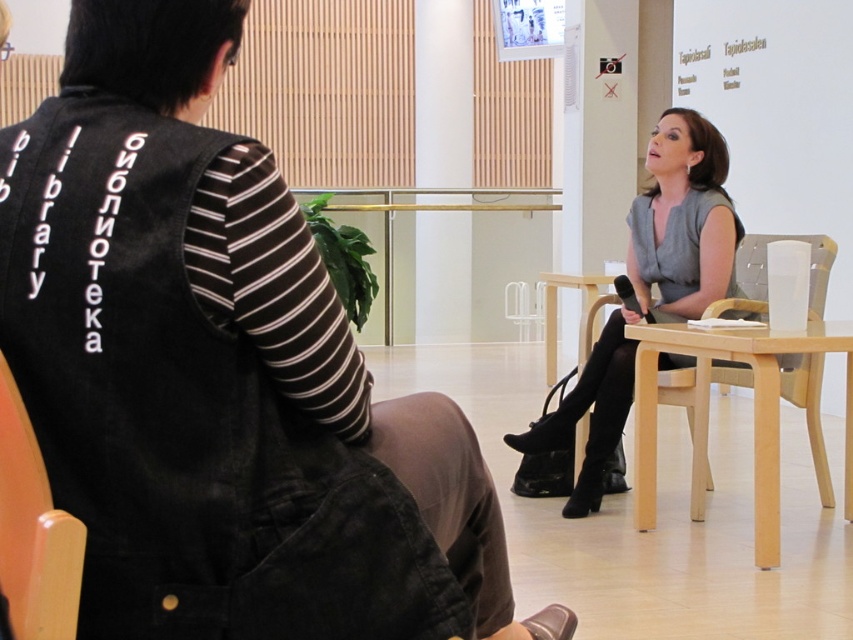
Is denim vest at center further to the viewer compared to light wood armchair at right?

That is False.

Is denim vest at center in front of light wood armchair at right?

Yes, it is.

Is point (219, 16) positioned after point (820, 502)?

That is False.

Locate an element on the screen. Image resolution: width=853 pixels, height=640 pixels. denim vest at center is located at coordinates (288, 282).

Looking at this image, does matte gray dress at center have a smaller size compared to wooden chair at lower left?

Incorrect, matte gray dress at center is not smaller in size than wooden chair at lower left.

Locate an element on the screen. matte gray dress at center is located at coordinates (648, 289).

Measure the distance between wooden chair at lower left and light wood armchair at right.

wooden chair at lower left and light wood armchair at right are 12.68 feet apart.

Who is more distant from viewer, [30,477] or [817,454]?

Point [817,454]

Measure the distance between point (30,577) and camera.

A distance of 4.82 feet exists between point (30,577) and camera.

I want to click on wooden chair at lower left, so click(x=33, y=531).